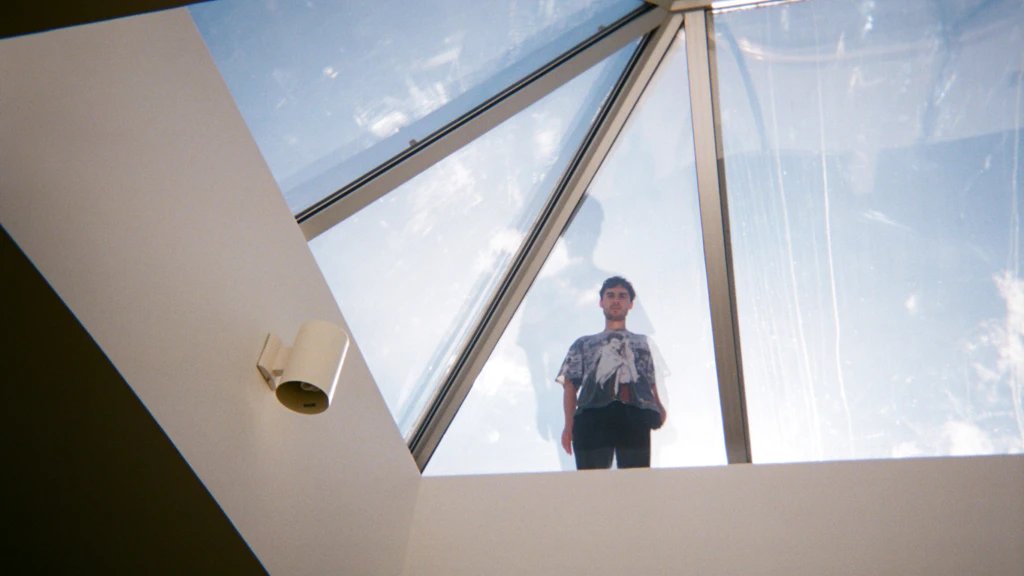
You are a GUI agent. You are given a task and a screenshot of the screen. Output one action in this format:
    pyautogui.click(x=<x>, y=<y>)
    Task: Click on the window border
    The width and height of the screenshot is (1024, 576).
    Given the screenshot: What is the action you would take?
    pyautogui.click(x=691, y=491)